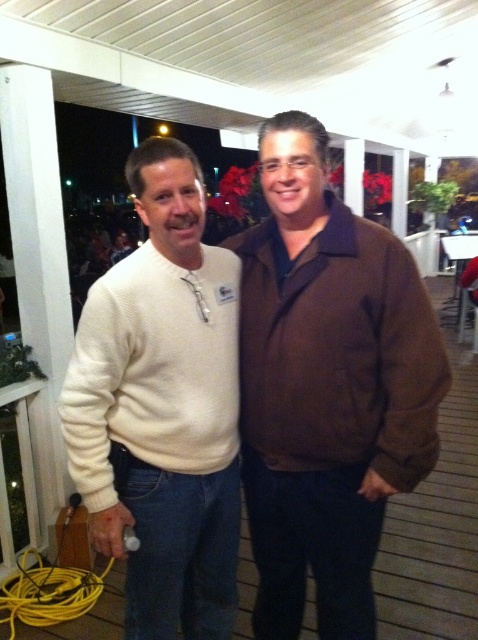
Does brown corduroy jacket at center appear over white sweater at left?

Yes, brown corduroy jacket at center is above white sweater at left.

Which of these two, brown corduroy jacket at center or white sweater at left, stands taller?

With more height is brown corduroy jacket at center.

What do you see at coordinates (326, 387) in the screenshot? The width and height of the screenshot is (478, 640). I see `brown corduroy jacket at center` at bounding box center [326, 387].

Where is `brown corduroy jacket at center`? The width and height of the screenshot is (478, 640). brown corduroy jacket at center is located at coordinates (326, 387).